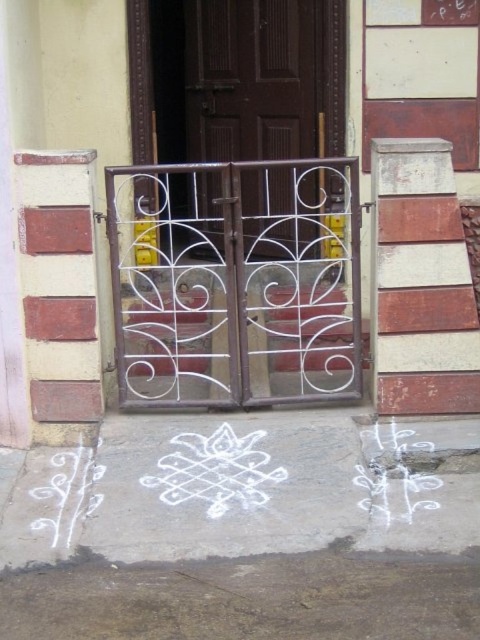
Question: Which point is closer to the camera taking this photo?

Choices:
 (A) (166, 461)
 (B) (380, 467)
 (C) (55, 497)

Answer: (C)

Question: Among these objects, which one is farthest from the camera?

Choices:
 (A) brown matte door at center
 (B) white chalk writing at lower center
 (C) white chalk design at lower left
 (D) white chalk drawing at center

Answer: (A)

Question: Can you confirm if white chalk design at lower center is thinner than brown matte door at center?

Choices:
 (A) yes
 (B) no

Answer: (B)

Question: Which point is closer to the camera?

Choices:
 (A) white chalk drawing at center
 (B) white chalk design at lower center
 (C) white chalk design at lower left

Answer: (B)

Question: Is white chalk drawing at center smaller than white chalk writing at lower center?

Choices:
 (A) no
 (B) yes

Answer: (A)

Question: Can you confirm if white chalk design at lower center is bigger than brown matte door at center?

Choices:
 (A) no
 (B) yes

Answer: (A)